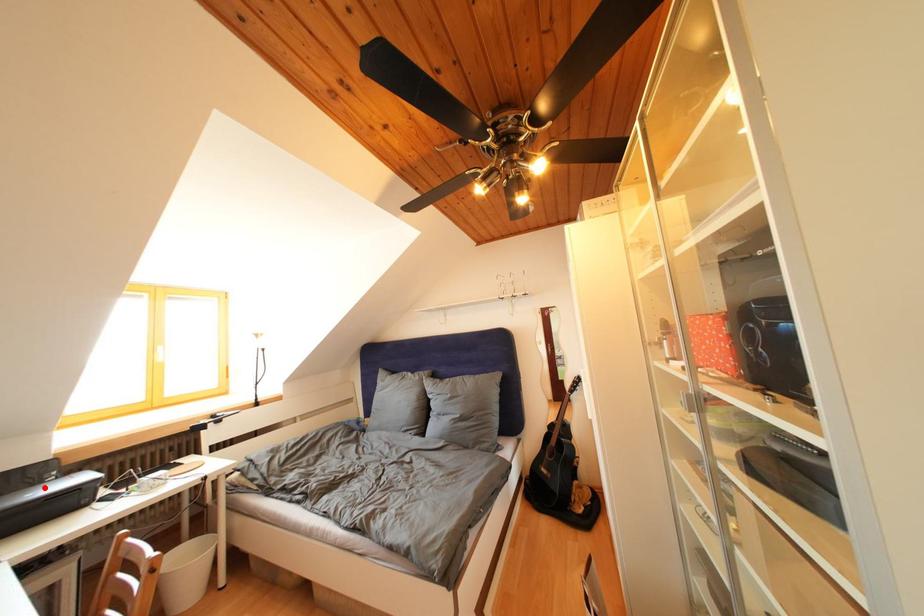
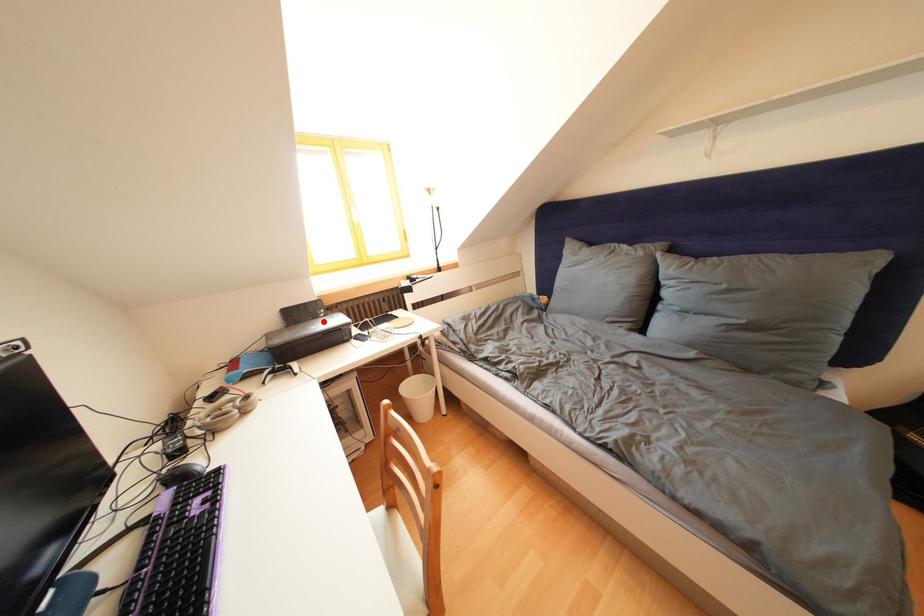
I am providing you with two images of the same scene from different viewpoints. A red point is marked on the first image and another point is marked on the second image. Does the point marked in image1 correspond to the same location as the one in image2?

Yes